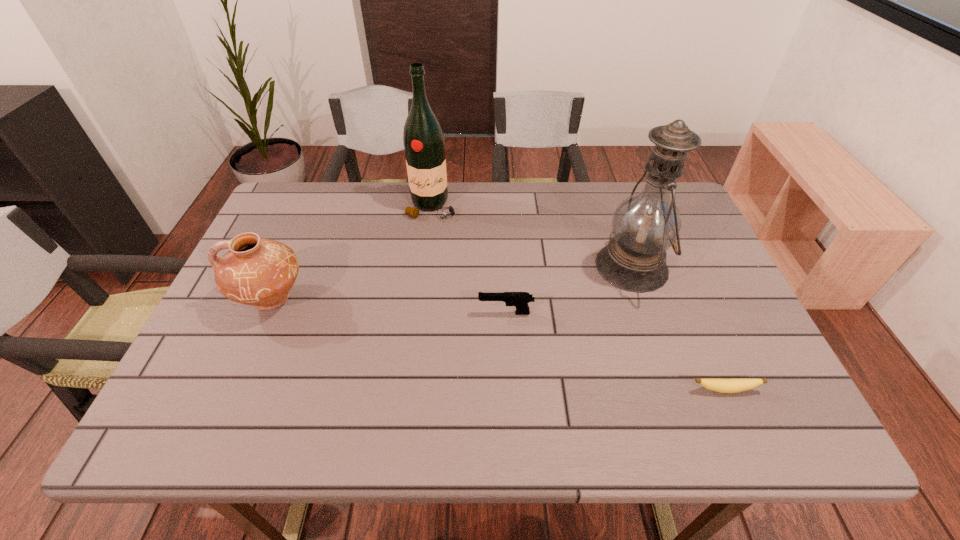
Identify the location of vacant area situated 0.080m on the left of the oil lamp. (566, 266).

I want to click on free space located 0.350m on the front-facing side of the third object from left to right, so click(x=333, y=313).

Locate an element on the screen. This screenshot has height=540, width=960. free spot located on the front-facing side of the third object from left to right is located at coordinates (396, 313).

At what (x,y) coordinates should I click in order to perform the action: click on free spot located 0.400m on the front-facing side of the third object from left to right. Please return your answer as a coordinate pair (x, y). This screenshot has height=540, width=960. Looking at the image, I should click on (312, 313).

Where is `vacant space located 0.140m on the left of the nearest object`? This screenshot has height=540, width=960. vacant space located 0.140m on the left of the nearest object is located at coordinates (623, 389).

This screenshot has width=960, height=540. I want to click on object that is at the far edge, so click(424, 145).

I want to click on object located at the left edge, so click(x=258, y=272).

In order to click on oil lamp located in the right edge section of the desktop in this screenshot , I will do [x=645, y=225].

Where is `banana at the right edge`? banana at the right edge is located at coordinates click(719, 385).

Where is `vacant area at the far edge`? vacant area at the far edge is located at coordinates (535, 191).